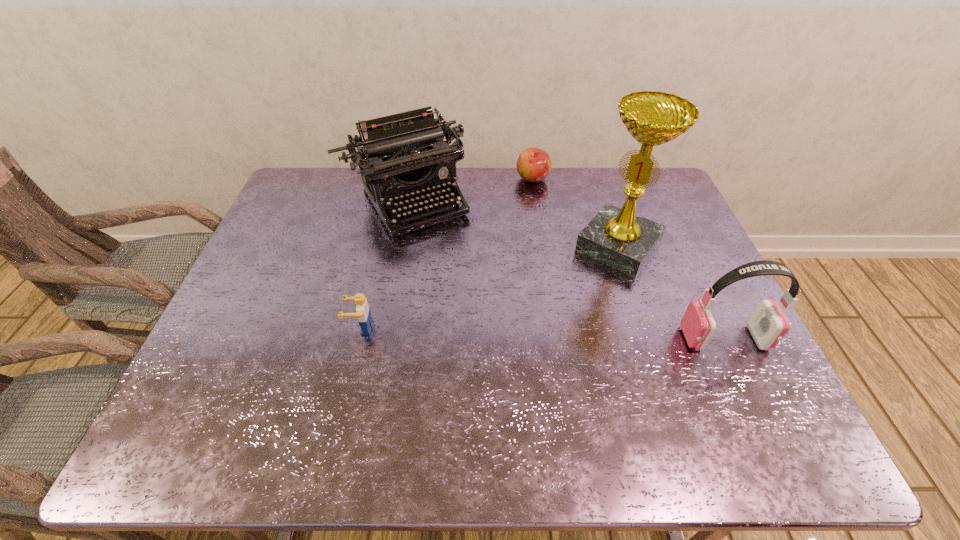
The height and width of the screenshot is (540, 960). I want to click on free space on the desktop that is between the Lego and the earphone and is positioned on the stem of the third object from left to right, so click(x=580, y=334).

This screenshot has height=540, width=960. In order to click on free space on the desktop that is between the Lego and the earphone and is positioned on the front-facing side of the award in this screenshot , I will do `click(549, 333)`.

Where is `vacant spot on the desktop that is between the Lego and the earphone and is positioned on the keyboard of the typewriter`? The width and height of the screenshot is (960, 540). vacant spot on the desktop that is between the Lego and the earphone and is positioned on the keyboard of the typewriter is located at coordinates (492, 332).